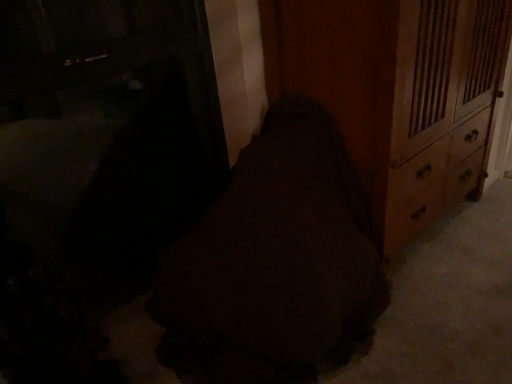
Question: Should I look upward or downward to see wooden chest of drawers at right?

Choices:
 (A) down
 (B) up

Answer: (B)